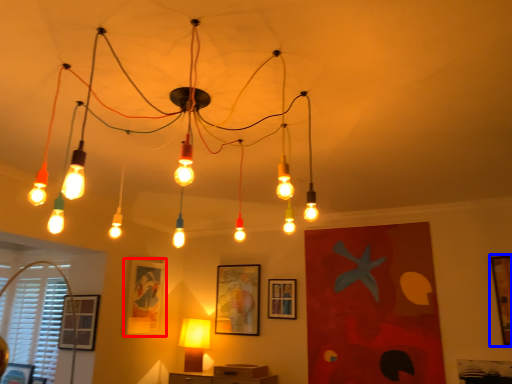
Question: Which object is further to the camera taking this photo, picture frame (highlighted by a red box) or picture frame (highlighted by a blue box)?

Choices:
 (A) picture frame
 (B) picture frame

Answer: (A)